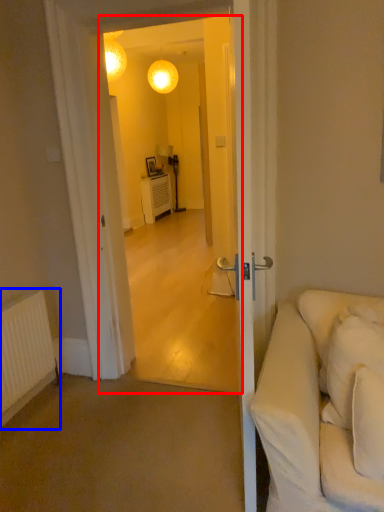
Question: Which object appears closest to the camera in this image, screen door (highlighted by a red box) or radiator (highlighted by a blue box)?

Choices:
 (A) screen door
 (B) radiator

Answer: (A)